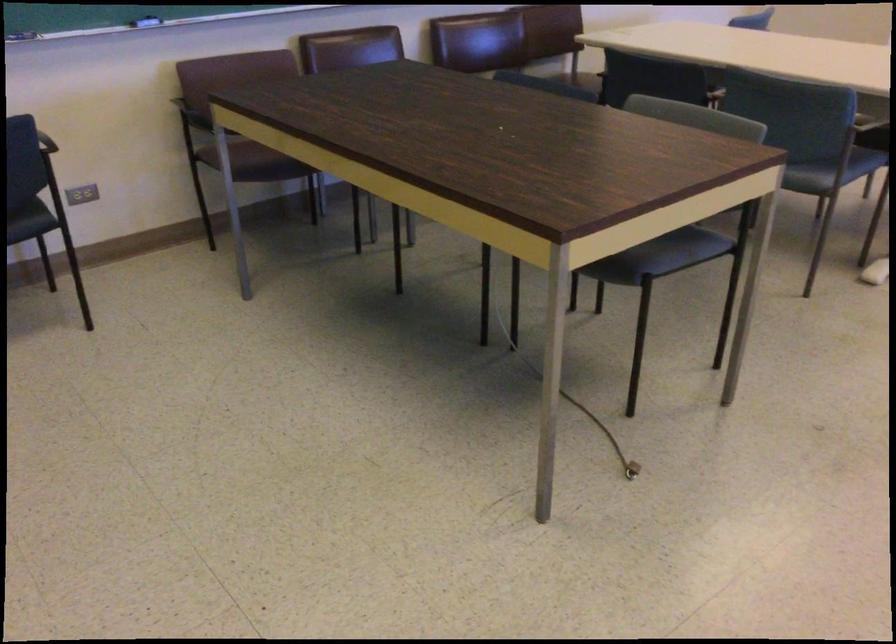
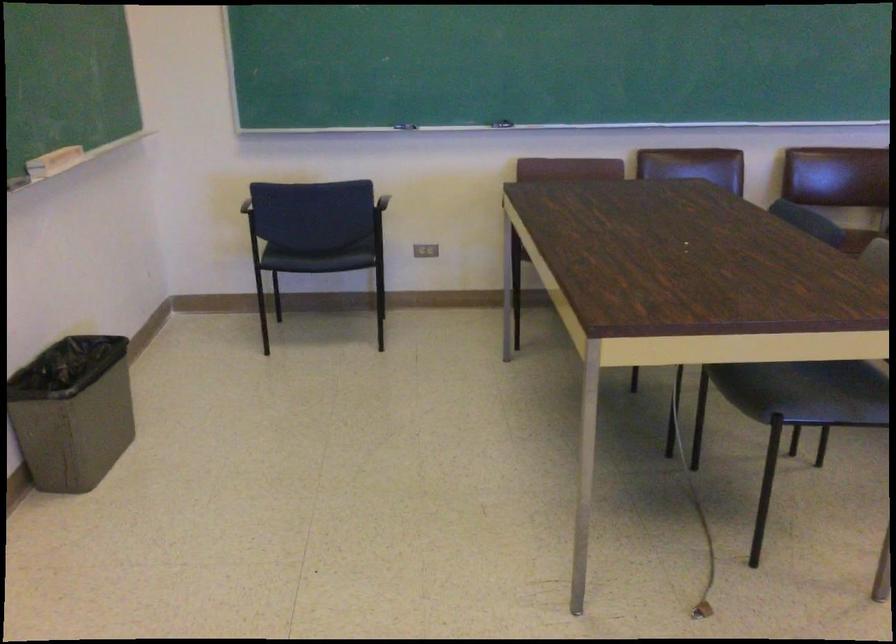
Find the pixel in the second image that matches (x=618, y=256) in the first image.

(765, 391)